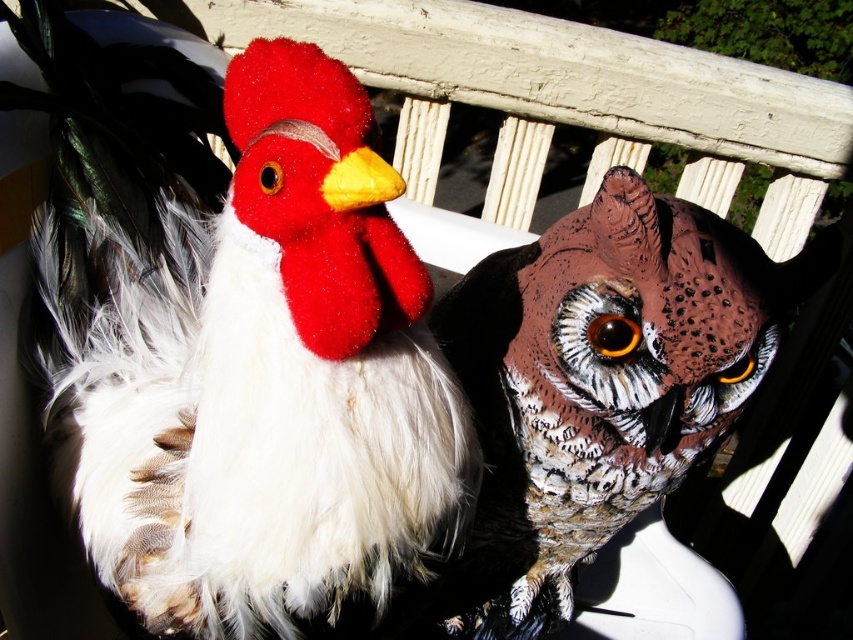
Between white soft plush at center and speckled brown owl at center, which one appears on the right side from the viewer's perspective?

Positioned to the right is speckled brown owl at center.

Is white soft plush at center bigger than speckled brown owl at center?

Yes.

Locate an element on the screen. This screenshot has width=853, height=640. white soft plush at center is located at coordinates (251, 368).

Locate an element on the screen. white soft plush at center is located at coordinates (251, 368).